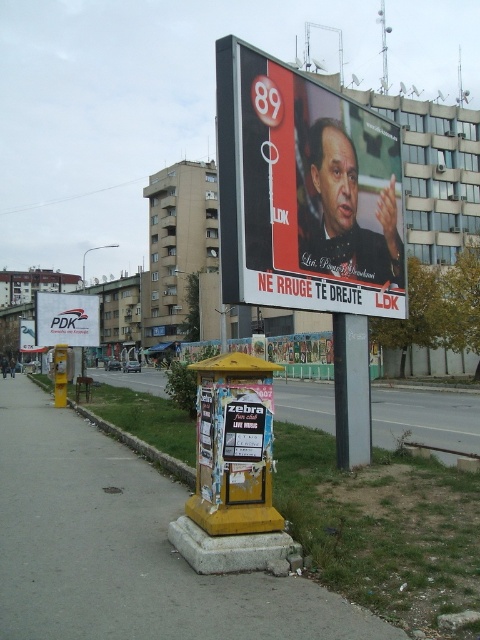
You are a delivery person who needs to place a small package on the yellow newspaper box. The package must be placed precisely at the point marked as point (425, 417). However, the yellow newspaper box is covered with posters. Can you place the package there without moving any posters?

The point (425, 417) is described as yellow painted concrete at lower center, which means there is no space available on the yellow newspaper box to place the package at that specific point without moving posters.

You are a delivery person who needs to attach a new advertisement to the white plastic billboard at center. However, you notice another matte black poster at center. Can you place your advertisement next to it without overlapping?

The matte black poster at center is bigger than the white plastic billboard at center, so there might not be enough space to place another advertisement next to it without overlapping.